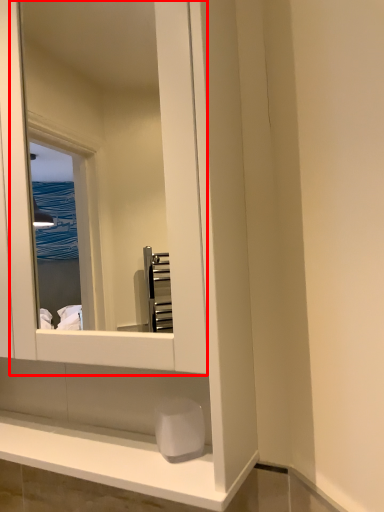
Question: Observing the image, what is the correct spatial positioning of mirror (annotated by the red box) in reference to soap?

Choices:
 (A) right
 (B) left

Answer: (B)